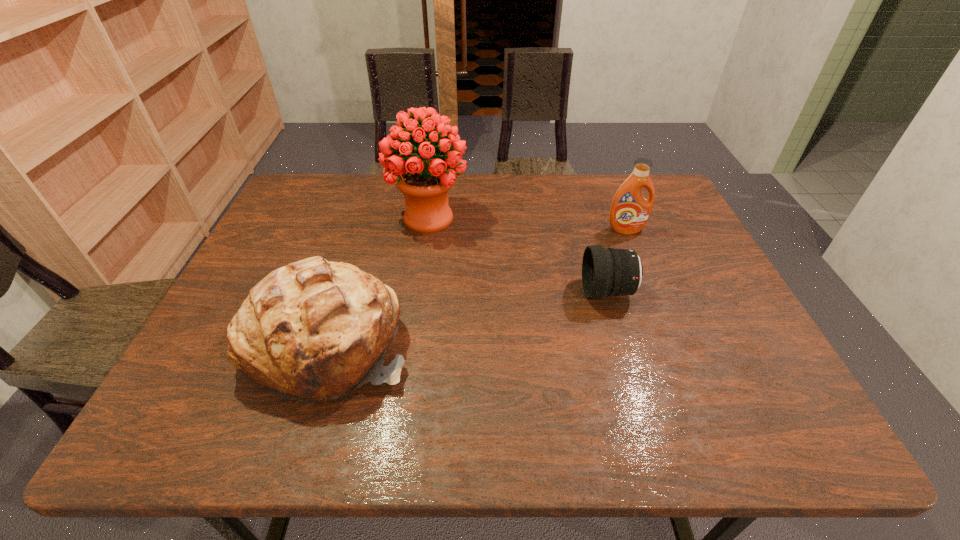
Locate an element on the screen. Image resolution: width=960 pixels, height=540 pixels. vacant region that satisfies the following two spatial constraints: 1. on the front-facing side of the detergent; 2. at the front element of the shortest object is located at coordinates (651, 292).